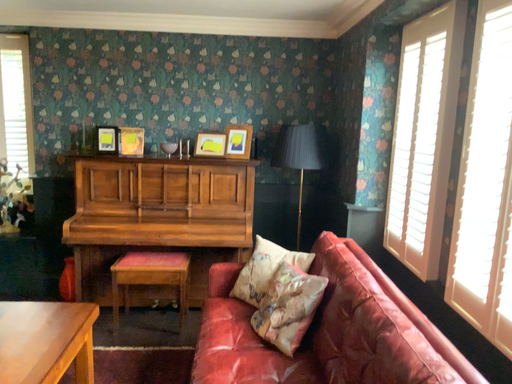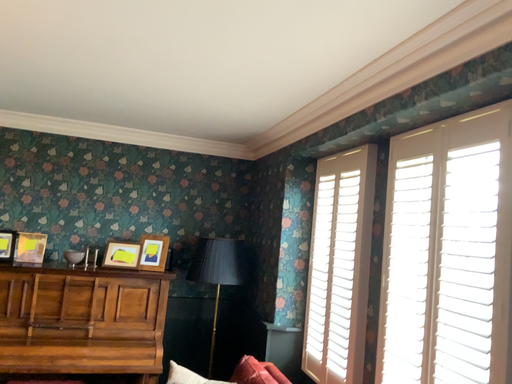
Question: Which way did the camera rotate in the video?

Choices:
 (A) rotated upward
 (B) rotated downward

Answer: (A)